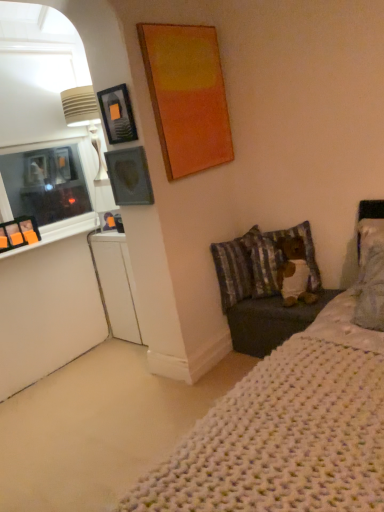
Question: Is matte gray picture frame at upper left, acting as the second picture frame starting from the top, at the right side of striped fabric pillow at lower right, marked as the first pillow in a left-to-right arrangement?

Choices:
 (A) no
 (B) yes

Answer: (A)

Question: Is striped fabric pillow at lower right, the second pillow positioned from the right, inside matte gray picture frame at upper left, the 1th picture frame positioned from the bottom?

Choices:
 (A) yes
 (B) no

Answer: (B)

Question: Does matte gray picture frame at upper left, acting as the second picture frame starting from the top, have a smaller size compared to striped fabric pillow at lower right, marked as the first pillow in a left-to-right arrangement?

Choices:
 (A) no
 (B) yes

Answer: (B)

Question: From a real-world perspective, does matte gray picture frame at upper left, acting as the second picture frame starting from the top, stand above striped fabric pillow at lower right, marked as the first pillow in a left-to-right arrangement?

Choices:
 (A) yes
 (B) no

Answer: (A)

Question: Considering the relative sizes of matte gray picture frame at upper left, the 1th picture frame positioned from the bottom, and striped fabric pillow at lower right, the second pillow positioned from the right, in the image provided, is matte gray picture frame at upper left, the 1th picture frame positioned from the bottom, thinner than striped fabric pillow at lower right, the second pillow positioned from the right,?

Choices:
 (A) yes
 (B) no

Answer: (A)

Question: Is matte gray picture frame at upper left, acting as the second picture frame starting from the top, shorter than striped fabric pillow at lower right, the second pillow positioned from the right?

Choices:
 (A) yes
 (B) no

Answer: (A)

Question: Does striped fabric pillow at lower right, marked as the first pillow in a left-to-right arrangement, appear on the left side of matte gray picture frame at upper left, the 1th picture frame positioned from the bottom?

Choices:
 (A) no
 (B) yes

Answer: (A)

Question: Is matte gray picture frame at upper left, acting as the second picture frame starting from the top, at the back of striped fabric pillow at lower right, the second pillow positioned from the right?

Choices:
 (A) no
 (B) yes

Answer: (A)

Question: Does striped fabric pillow at lower right, the second pillow positioned from the right, appear on the right side of matte gray picture frame at upper left, the 1th picture frame positioned from the bottom?

Choices:
 (A) yes
 (B) no

Answer: (A)

Question: From the image's perspective, is striped fabric pillow at lower right, marked as the first pillow in a left-to-right arrangement, over matte gray picture frame at upper left, the 1th picture frame positioned from the bottom?

Choices:
 (A) yes
 (B) no

Answer: (B)

Question: Is striped fabric pillow at lower right, marked as the first pillow in a left-to-right arrangement, aimed at matte gray picture frame at upper left, the 1th picture frame positioned from the bottom?

Choices:
 (A) no
 (B) yes

Answer: (A)

Question: Is matte gray picture frame at upper left, the 1th picture frame positioned from the bottom, a part of striped fabric pillow at lower right, marked as the first pillow in a left-to-right arrangement?

Choices:
 (A) yes
 (B) no

Answer: (B)

Question: Can you confirm if striped fabric pillow at lower right, the second pillow positioned from the right, is thinner than white glossy dresser at lower left?

Choices:
 (A) yes
 (B) no

Answer: (A)